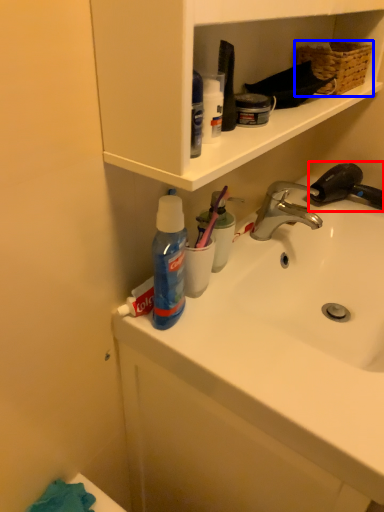
Question: Which object appears farthest to the camera in this image, faucet (highlighted by a red box) or basket (highlighted by a blue box)?

Choices:
 (A) faucet
 (B) basket

Answer: (A)